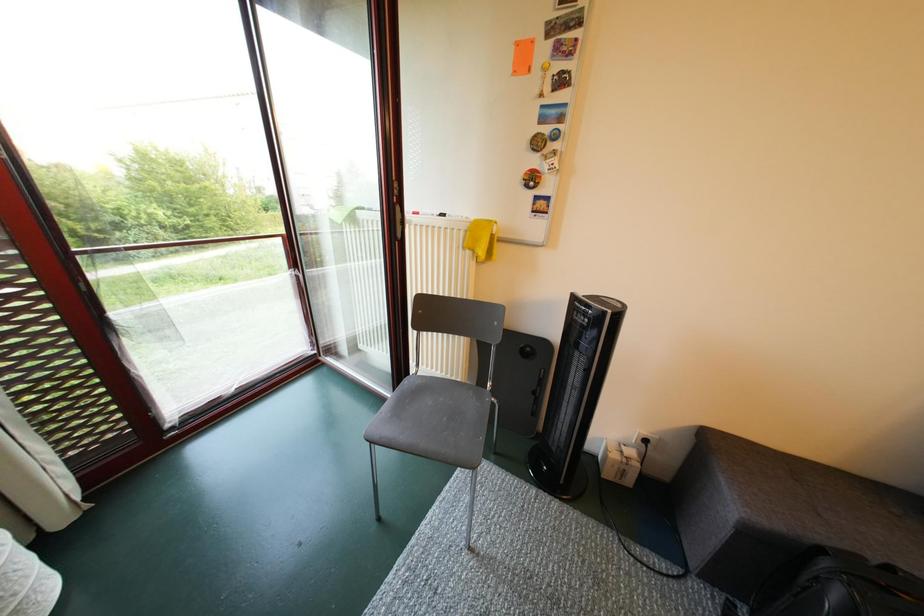
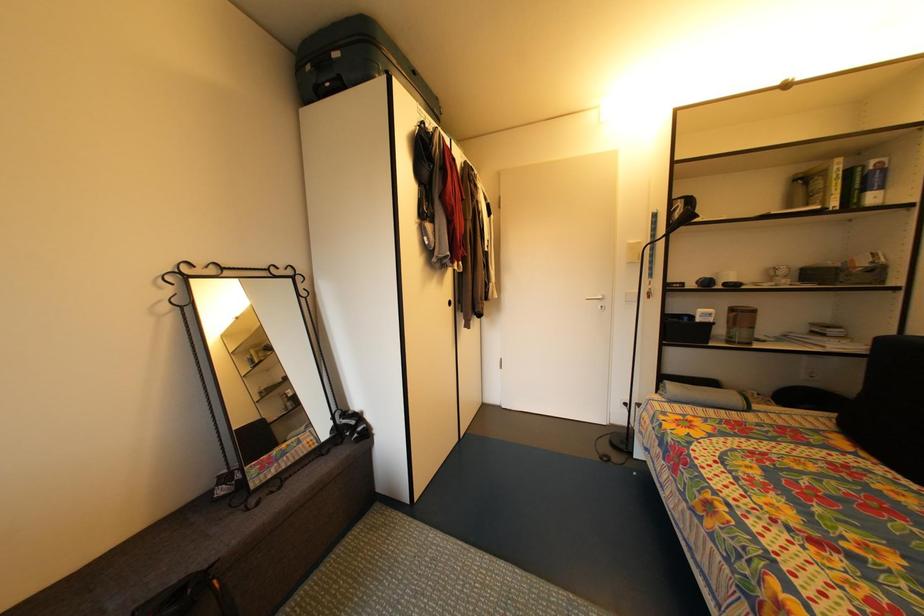
Question: How did the camera likely rotate?

Choices:
 (A) Left
 (B) Right
 (C) Up
 (D) Down

Answer: (B)